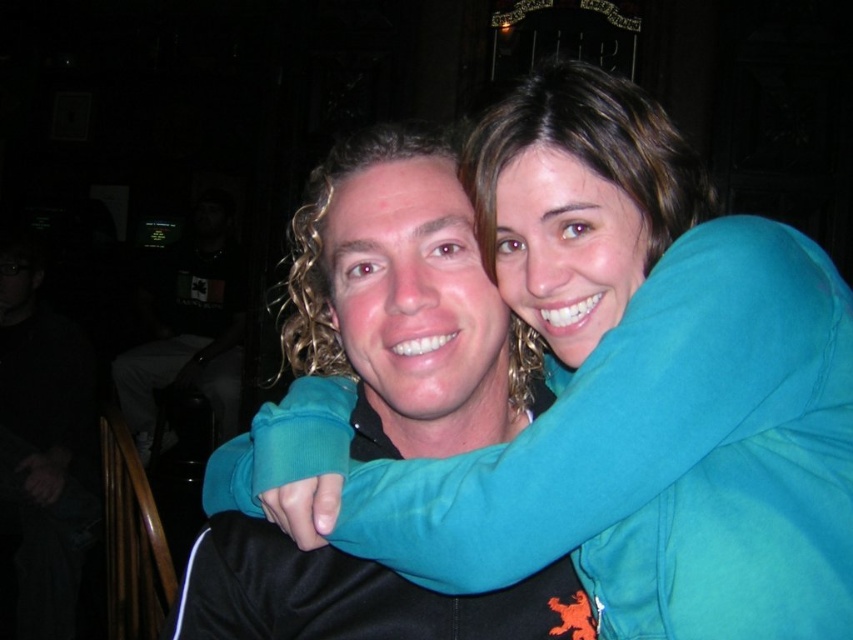
Question: Does teal fleece jacket at center appear under matte teal hoodie at center?

Choices:
 (A) yes
 (B) no

Answer: (A)

Question: Which point is closer to the camera?

Choices:
 (A) teal fleece jacket at center
 (B) matte teal hoodie at center

Answer: (A)

Question: Does teal fleece jacket at center appear on the left side of matte teal hoodie at center?

Choices:
 (A) no
 (B) yes

Answer: (A)

Question: Which point is farther to the camera?

Choices:
 (A) teal fleece jacket at center
 (B) matte teal hoodie at center

Answer: (B)

Question: Which point is closer to the camera taking this photo?

Choices:
 (A) (520, 394)
 (B) (590, 221)

Answer: (B)

Question: Can you confirm if teal fleece jacket at center is bigger than matte teal hoodie at center?

Choices:
 (A) yes
 (B) no

Answer: (A)